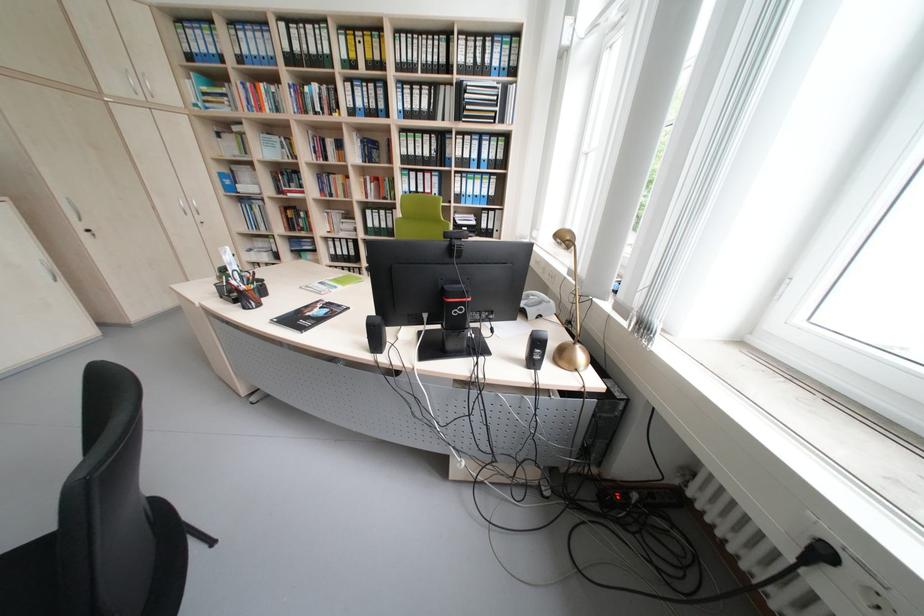
The height and width of the screenshot is (616, 924). I want to click on chair sitting surface, so pyautogui.click(x=30, y=578).